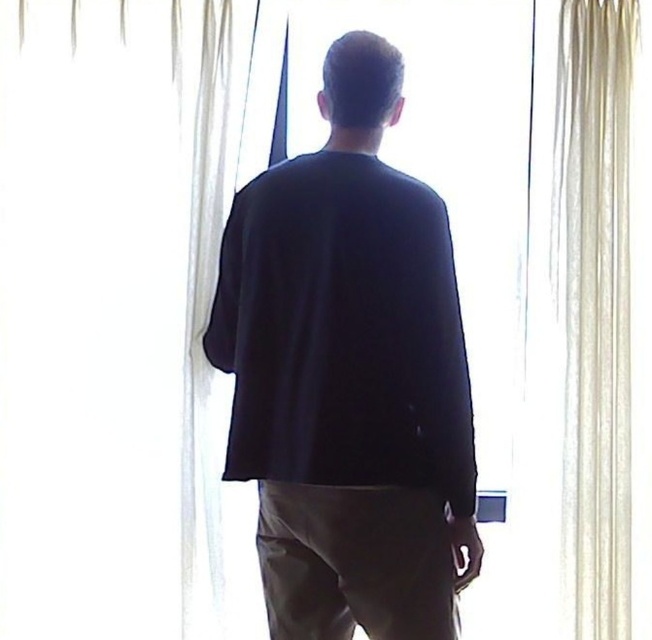
Who is shorter, white sheer curtain at center or sheer white curtain at right?

Standing shorter between the two is sheer white curtain at right.

Does point (72, 467) come closer to viewer compared to point (604, 381)?

No, it is behind (604, 381).

Find the location of `white sheer curtain at center`. white sheer curtain at center is located at coordinates (138, 294).

Identify the location of white sheer curtain at center. This screenshot has width=652, height=640. (138, 294).

Is white sheer curtain at center further to camera compared to black matte shirt at center?

That is True.

At what (x,y) coordinates should I click in order to perform the action: click on white sheer curtain at center. Please return your answer as a coordinate pair (x, y). This screenshot has height=640, width=652. Looking at the image, I should click on (138, 294).

Between point (151, 189) and point (359, 348), which one is positioned behind?

Positioned behind is point (151, 189).

Locate an element on the screen. This screenshot has height=640, width=652. white sheer curtain at center is located at coordinates (138, 294).

Is black matte shirt at center below sheer white curtain at right?

Correct, black matte shirt at center is located below sheer white curtain at right.

Can you confirm if black matte shirt at center is positioned above sheer white curtain at right?

No, black matte shirt at center is not above sheer white curtain at right.

Does point (312, 529) lie behind point (565, 627)?

No, it is not.

Find the location of a particular element. Image resolution: width=652 pixels, height=640 pixels. black matte shirt at center is located at coordinates (349, 376).